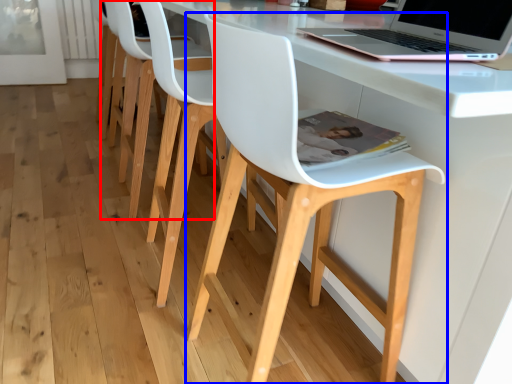
Question: Among these objects, which one is farthest to the camera, chair (highlighted by a red box) or chair (highlighted by a blue box)?

Choices:
 (A) chair
 (B) chair

Answer: (A)